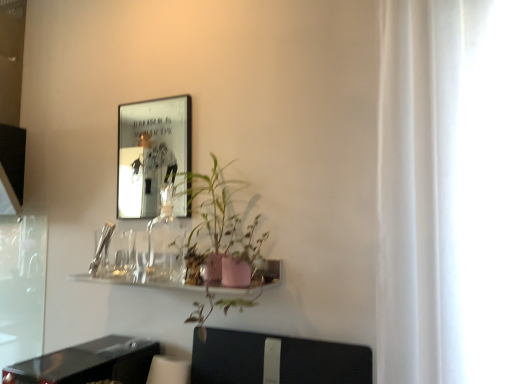
Question: Is metallic reflective frame at upper left at the right side of transparent glass screen door at left?

Choices:
 (A) yes
 (B) no

Answer: (A)

Question: Is metallic reflective frame at upper left taller than transparent glass screen door at left?

Choices:
 (A) yes
 (B) no

Answer: (B)

Question: From a real-world perspective, does metallic reflective frame at upper left sit lower than transparent glass screen door at left?

Choices:
 (A) yes
 (B) no

Answer: (B)

Question: Is metallic reflective frame at upper left looking in the opposite direction of transparent glass screen door at left?

Choices:
 (A) yes
 (B) no

Answer: (B)

Question: Is metallic reflective frame at upper left at the left side of transparent glass screen door at left?

Choices:
 (A) yes
 (B) no

Answer: (B)

Question: Can you see metallic reflective frame at upper left touching transparent glass screen door at left?

Choices:
 (A) yes
 (B) no

Answer: (B)

Question: Can you confirm if black plastic swivel chair at lower center is positioned to the left of metallic reflective frame at upper left?

Choices:
 (A) no
 (B) yes

Answer: (A)

Question: From the image's perspective, is black plastic swivel chair at lower center located beneath metallic reflective frame at upper left?

Choices:
 (A) yes
 (B) no

Answer: (A)

Question: Can you confirm if black plastic swivel chair at lower center is taller than metallic reflective frame at upper left?

Choices:
 (A) yes
 (B) no

Answer: (B)

Question: Is the position of black plastic swivel chair at lower center more distant than that of metallic reflective frame at upper left?

Choices:
 (A) no
 (B) yes

Answer: (A)

Question: Considering the relative positions of black plastic swivel chair at lower center and metallic reflective frame at upper left in the image provided, is black plastic swivel chair at lower center in front of metallic reflective frame at upper left?

Choices:
 (A) no
 (B) yes

Answer: (B)

Question: Is metallic reflective frame at upper left located within black plastic swivel chair at lower center?

Choices:
 (A) yes
 (B) no

Answer: (B)

Question: From a real-world perspective, is black plastic swivel chair at lower center located beneath black glossy table at lower left?

Choices:
 (A) no
 (B) yes

Answer: (A)